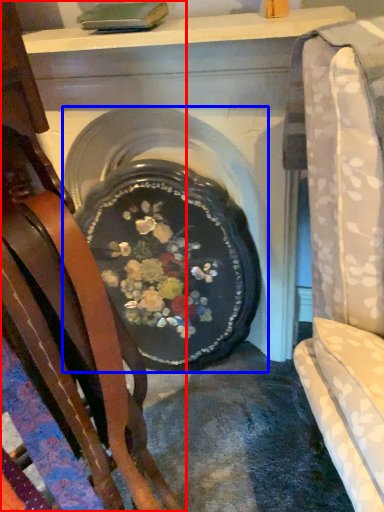
Question: Which point is further to the camera, chair (highlighted by a red box) or fireplace (highlighted by a blue box)?

Choices:
 (A) chair
 (B) fireplace

Answer: (B)